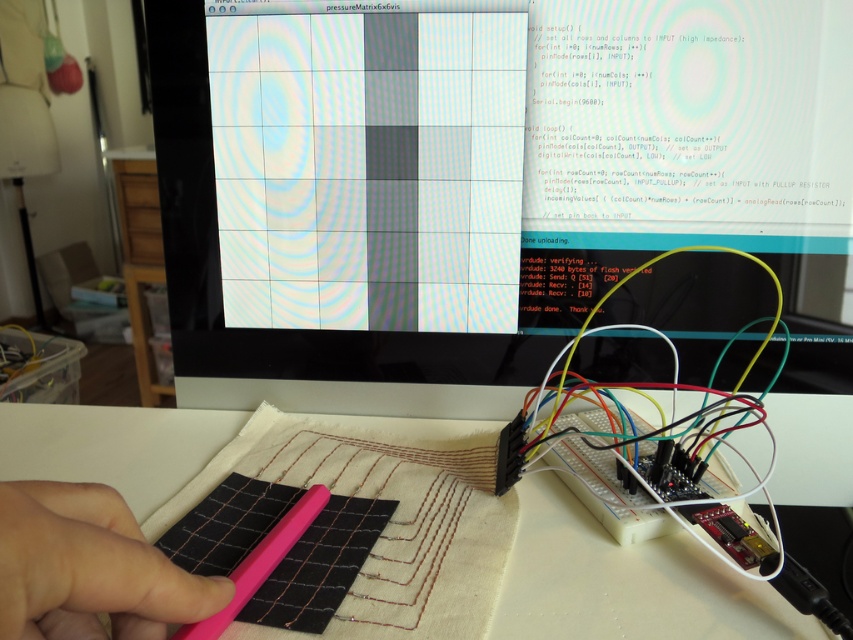
Which of these two, matte plastic monitor at center or white fabric at center, stands shorter?

Standing shorter between the two is white fabric at center.

How far apart are matte plastic monitor at center and white fabric at center?

matte plastic monitor at center is 6.63 inches from white fabric at center.

Is point (515, 17) positioned after point (566, 500)?

Yes, it is behind point (566, 500).

You are a GUI agent. You are given a task and a screenshot of the screen. Output one action in this format:
    pyautogui.click(x=<x>, y=<y>)
    Task: Click on the matte plastic monitor at center
    
    Given the screenshot: What is the action you would take?
    pyautogui.click(x=480, y=180)

Can you confirm if matte plastic monitor at center is positioned to the left of pink rubber at lower left?

In fact, matte plastic monitor at center is to the right of pink rubber at lower left.

Who is more forward, (x=772, y=16) or (x=33, y=547)?

Point (x=33, y=547)

Identify the location of matte plastic monitor at center. (480, 180).

Can you confirm if pink rubber at lower left is shorter than pink plastic pen at center?

Incorrect, pink rubber at lower left's height does not fall short of pink plastic pen at center's.

Is pink rubber at lower left taller than pink plastic pen at center?

Correct, pink rubber at lower left is much taller as pink plastic pen at center.

Where is `pink rubber at lower left`? Image resolution: width=853 pixels, height=640 pixels. pink rubber at lower left is located at coordinates (88, 566).

At what (x,y) coordinates should I click in order to perform the action: click on pink rubber at lower left. Please return your answer as a coordinate pair (x, y). Looking at the image, I should click on (88, 566).